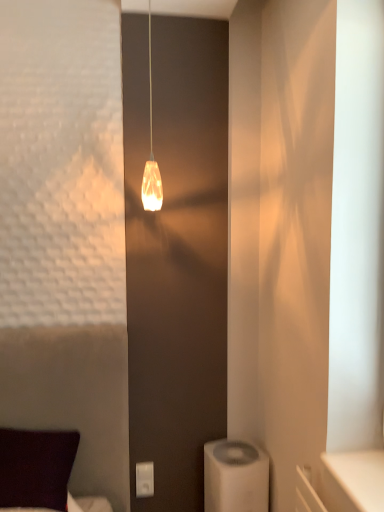
Question: Is white plastic/light switch at lower center wider than white plastic air purifier at lower right?

Choices:
 (A) no
 (B) yes

Answer: (A)

Question: Can you confirm if white plastic/light switch at lower center is positioned to the left of white plastic air purifier at lower right?

Choices:
 (A) no
 (B) yes

Answer: (B)

Question: Is white plastic/light switch at lower center facing away from white plastic air purifier at lower right?

Choices:
 (A) no
 (B) yes

Answer: (A)

Question: Is white plastic/light switch at lower center beside white plastic air purifier at lower right?

Choices:
 (A) yes
 (B) no

Answer: (B)

Question: From a real-world perspective, is white plastic/light switch at lower center over white plastic air purifier at lower right?

Choices:
 (A) yes
 (B) no

Answer: (A)

Question: Is white plastic/light switch at lower center shorter than white plastic air purifier at lower right?

Choices:
 (A) no
 (B) yes

Answer: (B)

Question: From a real-world perspective, is dark purple fabric pillow at lower left below translucent glass pendant light at center?

Choices:
 (A) no
 (B) yes

Answer: (B)

Question: Are dark purple fabric pillow at lower left and translucent glass pendant light at center beside each other?

Choices:
 (A) no
 (B) yes

Answer: (A)

Question: Can you confirm if dark purple fabric pillow at lower left is shorter than translucent glass pendant light at center?

Choices:
 (A) yes
 (B) no

Answer: (A)

Question: Can you confirm if dark purple fabric pillow at lower left is positioned to the left of translucent glass pendant light at center?

Choices:
 (A) no
 (B) yes

Answer: (B)

Question: Is dark purple fabric pillow at lower left positioned with its back to translucent glass pendant light at center?

Choices:
 (A) no
 (B) yes

Answer: (A)

Question: From a real-world perspective, is dark purple fabric pillow at lower left positioned over translucent glass pendant light at center based on gravity?

Choices:
 (A) yes
 (B) no

Answer: (B)

Question: Is white plastic air purifier at lower right next to white plastic/light switch at lower center?

Choices:
 (A) no
 (B) yes

Answer: (A)